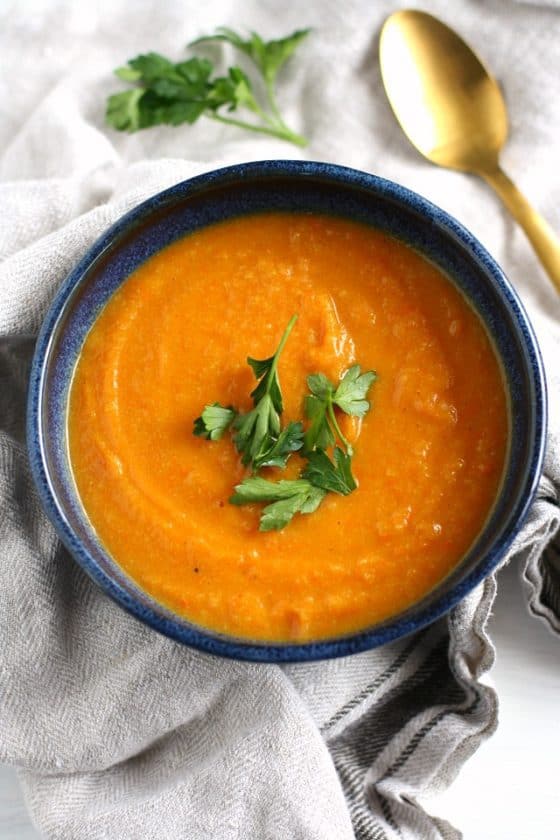
You are a GUI agent. You are given a task and a screenshot of the screen. Output one action in this format:
    pyautogui.click(x=<x>, y=<y>)
    Task: Click on the gray towel
    
    Given the screenshot: What is the action you would take?
    pyautogui.click(x=30, y=610)